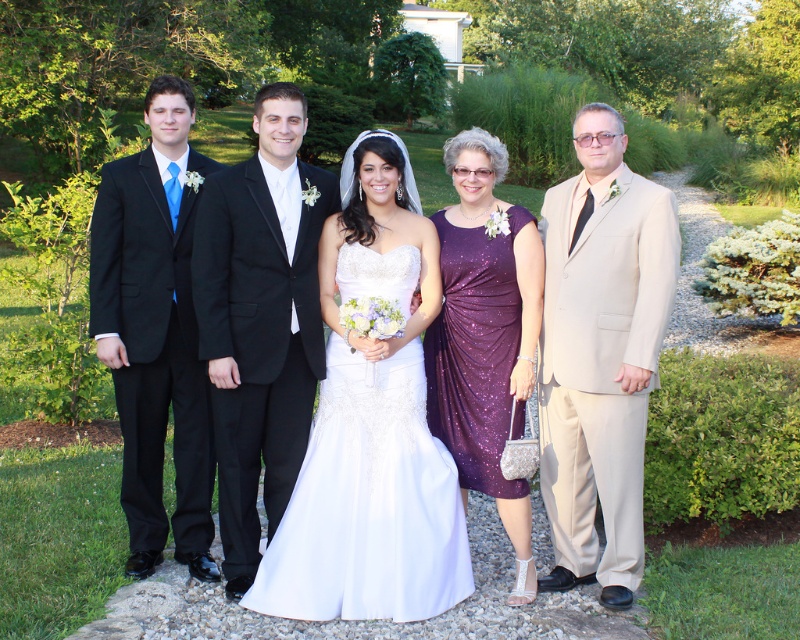
You are standing in the garden and want to walk from point A to point B. Point A is at coordinate point(x=322, y=275) and point B is at coordinate point(x=604, y=387). Which point is closer to you?

Point A at coordinate point(x=322, y=275) is closer to you because it is further to the viewer than point B at coordinate point(x=604, y=387).